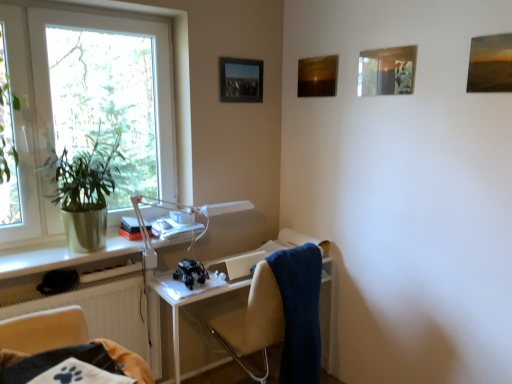
Question: Does metallic silver picture frame at upper center, the first picture frame viewed from the left, appear on the left side of beige fabric chair at lower left, the 2th chair from the back?

Choices:
 (A) yes
 (B) no

Answer: (B)

Question: Could beige fabric chair at lower left, the first chair viewed from the left, be considered to be inside metallic silver picture frame at upper center, placed as the fourth picture frame when sorted from front to back?

Choices:
 (A) no
 (B) yes

Answer: (A)

Question: From the image's perspective, would you say metallic silver picture frame at upper center, placed as the fourth picture frame when sorted from front to back, is shown under beige fabric chair at lower left, the 2th chair from the back?

Choices:
 (A) yes
 (B) no

Answer: (B)

Question: Is metallic silver picture frame at upper center, placed as the fourth picture frame when sorted from front to back, directly adjacent to beige fabric chair at lower left, the 2th chair from the back?

Choices:
 (A) no
 (B) yes

Answer: (A)

Question: Is metallic silver picture frame at upper center, the 4th picture frame viewed from the right, not inside beige fabric chair at lower left, the second chair viewed from the right?

Choices:
 (A) no
 (B) yes

Answer: (B)

Question: Is metallic silver picture frame at upper center, the 4th picture frame viewed from the right, facing away from beige fabric chair at lower left, the first chair viewed from the left?

Choices:
 (A) yes
 (B) no

Answer: (B)

Question: Is green leafy plant at left to the left of matte white window sill at lower left from the viewer's perspective?

Choices:
 (A) yes
 (B) no

Answer: (A)

Question: Is green leafy plant at left facing towards matte white window sill at lower left?

Choices:
 (A) yes
 (B) no

Answer: (B)

Question: Does green leafy plant at left lie in front of matte white window sill at lower left?

Choices:
 (A) yes
 (B) no

Answer: (B)

Question: Is green leafy plant at left surrounding matte white window sill at lower left?

Choices:
 (A) no
 (B) yes

Answer: (A)

Question: Is green leafy plant at left bigger than matte white window sill at lower left?

Choices:
 (A) no
 (B) yes

Answer: (B)

Question: From a real-world perspective, is green leafy plant at left on matte white window sill at lower left?

Choices:
 (A) no
 (B) yes

Answer: (B)

Question: Would you say matte wooden picture frame at upper right, the 1th picture frame in the right-to-left sequence, contains metallic silver picture frame at upper center, placed as the fourth picture frame when sorted from front to back?

Choices:
 (A) yes
 (B) no

Answer: (B)